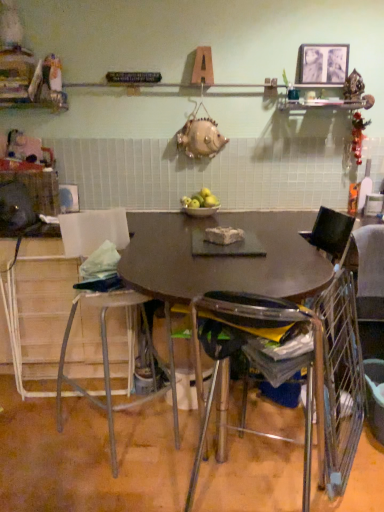
Question: Can you confirm if metallic wire chair at right, marked as the 3th chair in a left-to-right arrangement, is positioned to the right of green matte apples at center?

Choices:
 (A) yes
 (B) no

Answer: (A)

Question: Is metallic wire chair at right, marked as the 3th chair in a left-to-right arrangement, oriented away from green matte apples at center?

Choices:
 (A) yes
 (B) no

Answer: (B)

Question: From the image's perspective, is metallic wire chair at right, marked as the 3th chair in a left-to-right arrangement, over green matte apples at center?

Choices:
 (A) no
 (B) yes

Answer: (A)

Question: From a real-world perspective, is metallic wire chair at right, marked as the 3th chair in a left-to-right arrangement, located higher than green matte apples at center?

Choices:
 (A) yes
 (B) no

Answer: (B)

Question: Could green matte apples at center be considered to be inside metallic wire chair at right, arranged as the first chair when viewed from the right?

Choices:
 (A) no
 (B) yes

Answer: (A)

Question: Is metallic wire chair at right, arranged as the first chair when viewed from the right, not inside green matte apples at center?

Choices:
 (A) no
 (B) yes

Answer: (B)

Question: Considering the relative sizes of metallic wire chair at right, arranged as the first chair when viewed from the right, and metallic stool at lower left, which is the 1th chair from left to right, in the image provided, is metallic wire chair at right, arranged as the first chair when viewed from the right, thinner than metallic stool at lower left, which is the 1th chair from left to right,?

Choices:
 (A) no
 (B) yes

Answer: (B)

Question: Could you tell me if metallic wire chair at right, marked as the 3th chair in a left-to-right arrangement, is facing metallic stool at lower left, which is the 1th chair from left to right?

Choices:
 (A) no
 (B) yes

Answer: (B)

Question: From the image's perspective, would you say metallic wire chair at right, marked as the 3th chair in a left-to-right arrangement, is shown under metallic stool at lower left, the 3th chair from the right?

Choices:
 (A) yes
 (B) no

Answer: (B)

Question: From the image's perspective, is metallic wire chair at right, arranged as the first chair when viewed from the right, over metallic stool at lower left, which is the 1th chair from left to right?

Choices:
 (A) yes
 (B) no

Answer: (A)

Question: Does metallic wire chair at right, arranged as the first chair when viewed from the right, come in front of metallic stool at lower left, the 3th chair from the right?

Choices:
 (A) yes
 (B) no

Answer: (B)

Question: Can you confirm if metallic wire chair at right, marked as the 3th chair in a left-to-right arrangement, is wider than metallic stool at lower left, the 3th chair from the right?

Choices:
 (A) no
 (B) yes

Answer: (A)

Question: Is green matte apples at center far from clear plastic chair at center, the second chair from the right?

Choices:
 (A) no
 (B) yes

Answer: (B)